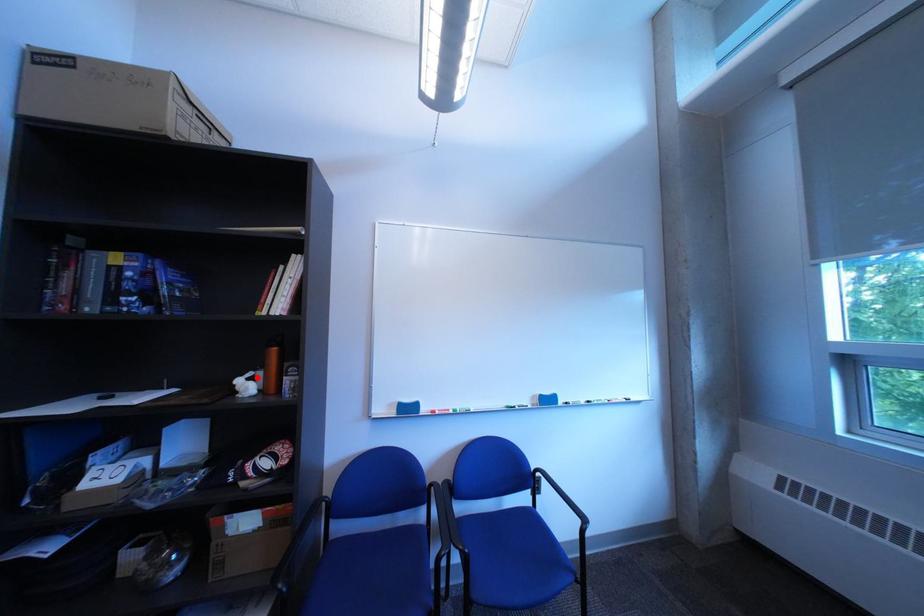
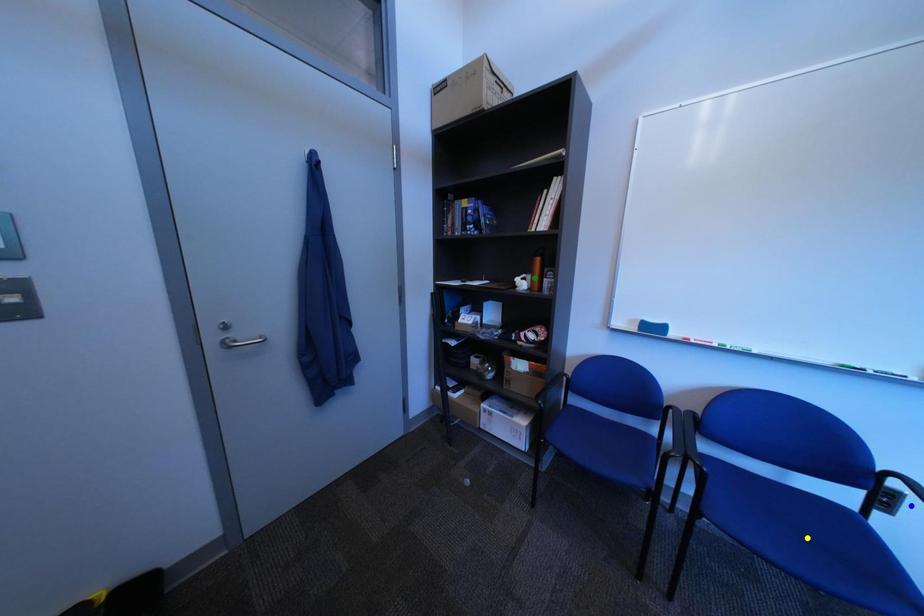
Question: I am providing you with two images of the same scene from different viewpoints. A red point is marked on the first image. You are given multiple points on the second image. In image 2, which mark is for the same physical point as the one in image 1?

Choices:
 (A) yellow point
 (B) green point
 (C) blue point

Answer: (B)